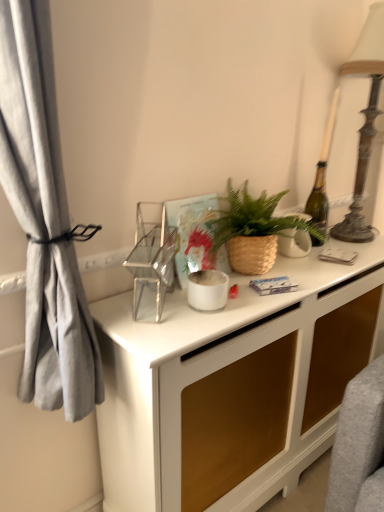
The height and width of the screenshot is (512, 384). Find the location of `vacant space in front of white matte pot at center, marked as the second appliance in a front-to-back arrangement`. vacant space in front of white matte pot at center, marked as the second appliance in a front-to-back arrangement is located at coordinates (191, 328).